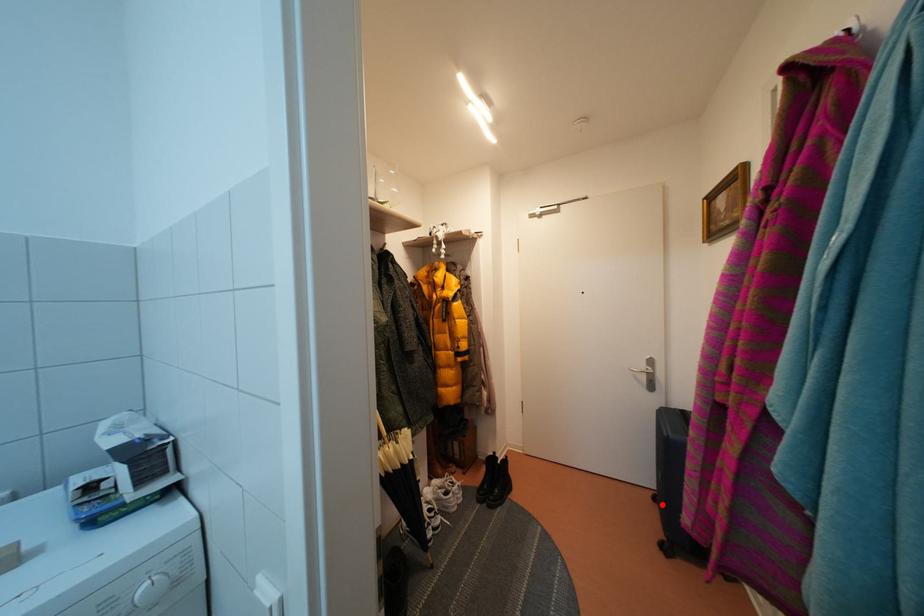
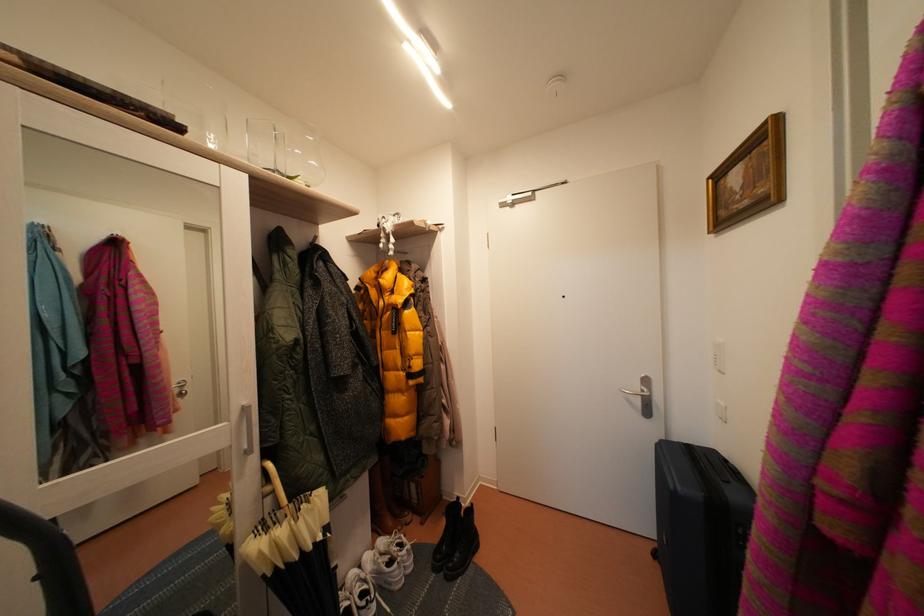
Question: A red point is marked in image1. In image2, is the corresponding 3D point closer to the camera or farther? Reply with the corresponding letter.

Choices:
 (A) The corresponding 3D point is closer.
 (B) The corresponding 3D point is farther.

Answer: (A)